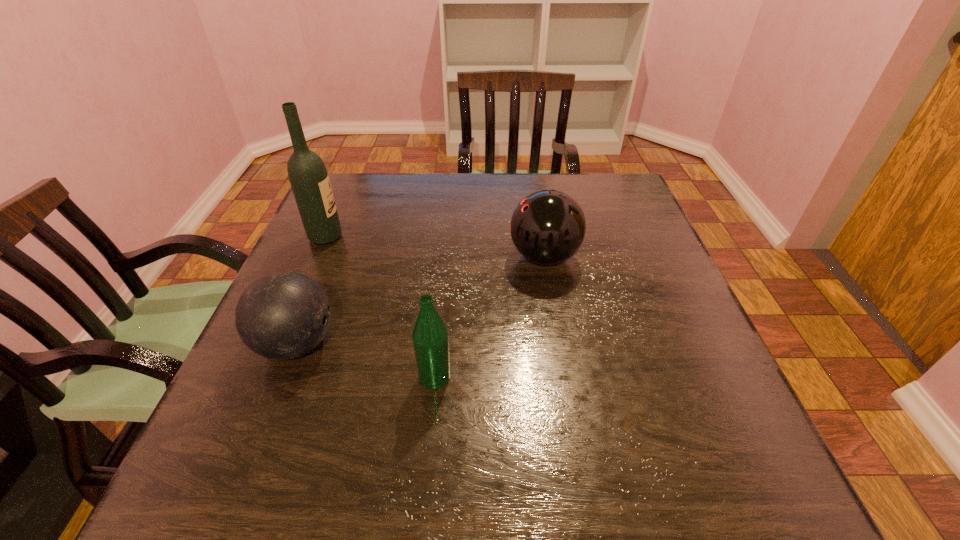
Where is `wine bottle`? The image size is (960, 540). wine bottle is located at coordinates [x=309, y=180].

I want to click on the second object from right to left, so click(x=430, y=339).

The image size is (960, 540). I want to click on the farther bowling ball, so click(x=547, y=227).

Find the location of `the rightmost object`. the rightmost object is located at coordinates (547, 227).

The image size is (960, 540). Find the location of `the left bowling ball`. the left bowling ball is located at coordinates (284, 315).

The width and height of the screenshot is (960, 540). In order to click on free space located on the labeled side of the tallest object in this screenshot , I will do tap(421, 237).

The width and height of the screenshot is (960, 540). Identify the location of free region located on the front of the second object from right to left. (430, 428).

The image size is (960, 540). Find the location of `vacant space located on the surface of the right bowling ball near the finger holes`. vacant space located on the surface of the right bowling ball near the finger holes is located at coordinates (371, 256).

In order to click on free space located 0.070m on the surface of the right bowling ball near the finger holes in this screenshot , I will do `click(480, 256)`.

Identify the location of vacant space located on the surface of the right bowling ball near the finger holes. (367, 256).